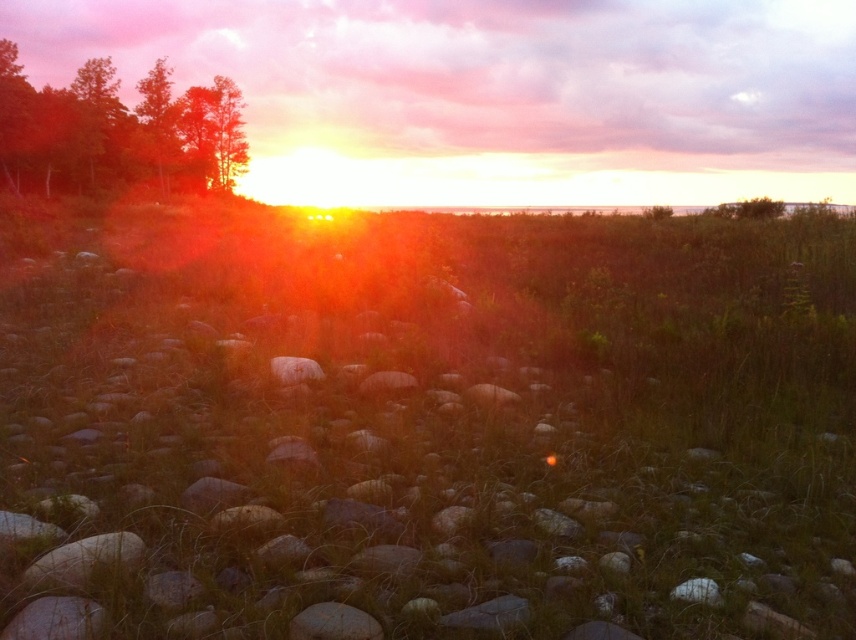
You are standing in the sunset scene and want to walk towards the horizon. Which object, the green grass at center or the green matte trees at left, will you encounter first?

You will encounter the green grass at center first because it is closer to the viewer than the green matte trees at left.

You are standing on the rocky shoreline and want to take a photo of the sunset. You notice the green grass at center and the green matte trees at left in your viewfinder. Which object will appear closer to the horizon in the photo?

The green grass at center will appear closer to the horizon in the photo because it is smaller than the green matte trees at left, indicating it is farther away from the observer.

You are standing at the edge of the rocky shoreline and see the point marked at coordinates (426,426). According to the scene description, what type of terrain is located at that point?

The point at (426,426) is on green grass at center.